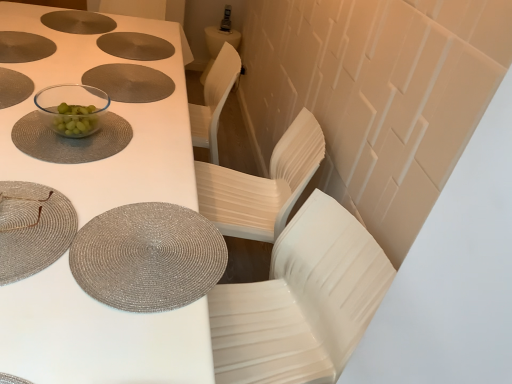
This screenshot has width=512, height=384. What are the coordinates of `free space on the front side of transparent glass bowl at center, which appears as the 2th tableware when viewed from the back` in the screenshot? It's located at (49, 154).